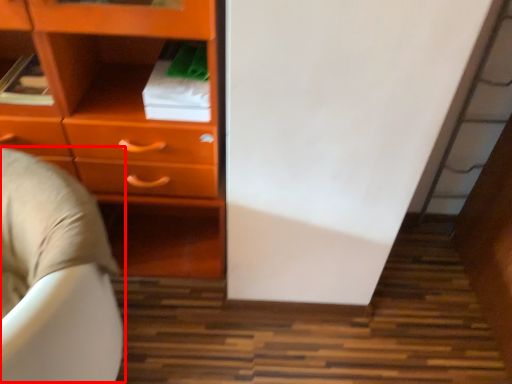
Question: From the image's perspective, where is bean bag chair (annotated by the red box) located relative to chest of drawers?

Choices:
 (A) above
 (B) below

Answer: (B)